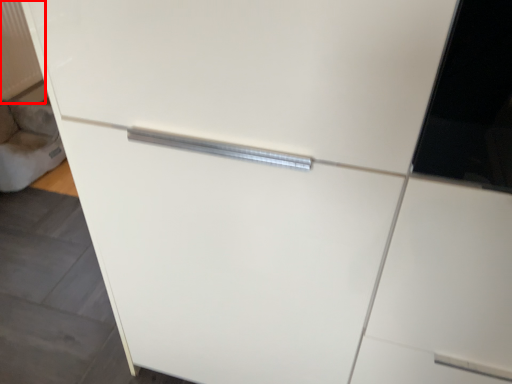
Question: From the image's perspective, considering the relative positions of radiator (annotated by the red box) and gray in the image provided, where is radiator (annotated by the red box) located with respect to the staircase?

Choices:
 (A) above
 (B) below

Answer: (A)